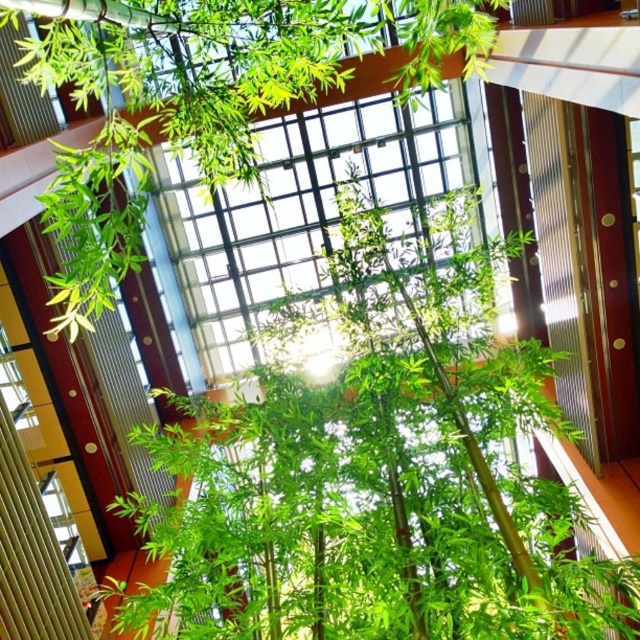
Is green bamboo at center positioned at the back of clear glass window at upper left?

No, it is in front of clear glass window at upper left.

Does green bamboo at center have a greater width compared to clear glass window at upper left?

No, green bamboo at center is not wider than clear glass window at upper left.

Who is more forward, (253, 524) or (58, 520)?

Point (253, 524) is more forward.

Where is `green bamboo at center`? The width and height of the screenshot is (640, 640). green bamboo at center is located at coordinates (376, 468).

Where is `green bamboo at center`? green bamboo at center is located at coordinates (376, 468).

Is point (484, 260) positioned in front of point (218, 262)?

Yes, point (484, 260) is in front of point (218, 262).

I want to click on green bamboo at center, so click(376, 468).

Between transparent glass window at center and clear glass window at upper left, which one is positioned higher?

transparent glass window at center is above.

In the scene shown: Who is positioned more to the left, transparent glass window at center or clear glass window at upper left?

clear glass window at upper left

From the picture: Measure the distance between point (316, 156) and camera.

14.34 meters

Image resolution: width=640 pixels, height=640 pixels. I want to click on transparent glass window at center, so click(x=285, y=209).